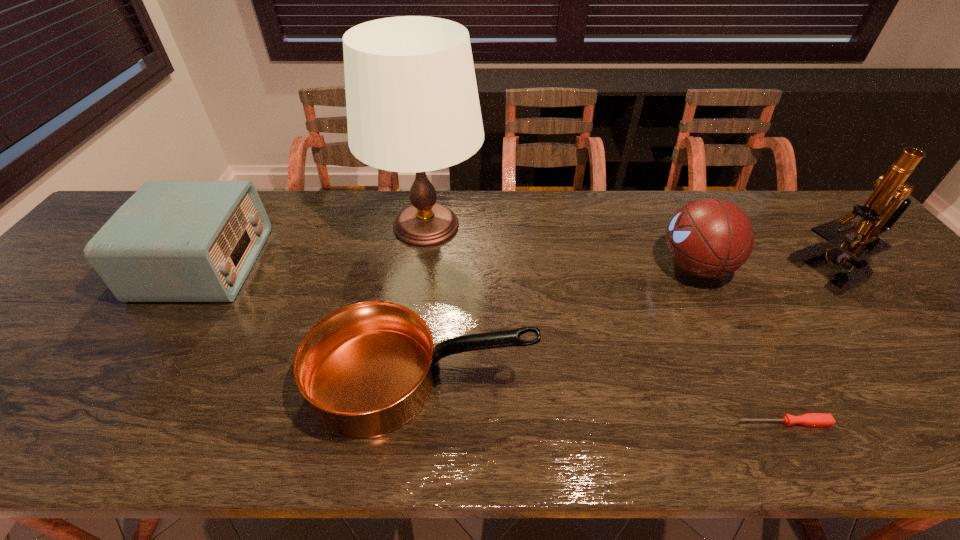
Where is `lamp`? The image size is (960, 540). lamp is located at coordinates (412, 102).

The width and height of the screenshot is (960, 540). What are the coordinates of `the rightmost object` in the screenshot? It's located at (887, 203).

Where is `the fifth shortest object`? The height and width of the screenshot is (540, 960). the fifth shortest object is located at coordinates pyautogui.click(x=887, y=203).

At what (x,y) coordinates should I click in order to perform the action: click on basketball. Please return your answer as a coordinate pair (x, y). The width and height of the screenshot is (960, 540). Looking at the image, I should click on (708, 238).

Where is `the leftmost object`? Image resolution: width=960 pixels, height=540 pixels. the leftmost object is located at coordinates (172, 241).

You are a GUI agent. You are given a task and a screenshot of the screen. Output one action in this format:
    pyautogui.click(x=<x>, y=<y>)
    Task: Click on the frying pan
    This screenshot has width=960, height=540.
    Given the screenshot: What is the action you would take?
    pyautogui.click(x=366, y=369)

Image resolution: width=960 pixels, height=540 pixels. Identify the location of the shortest object. click(x=809, y=419).

This screenshot has height=540, width=960. I want to click on vacant space situated on the left of the lamp, so click(282, 226).

The height and width of the screenshot is (540, 960). Identify the location of vacant space positioned 0.050m at the eyepiece of the rightmost object. (776, 271).

Where is `vacant space located at the eyepiece of the rightmost object`? vacant space located at the eyepiece of the rightmost object is located at coordinates (660, 271).